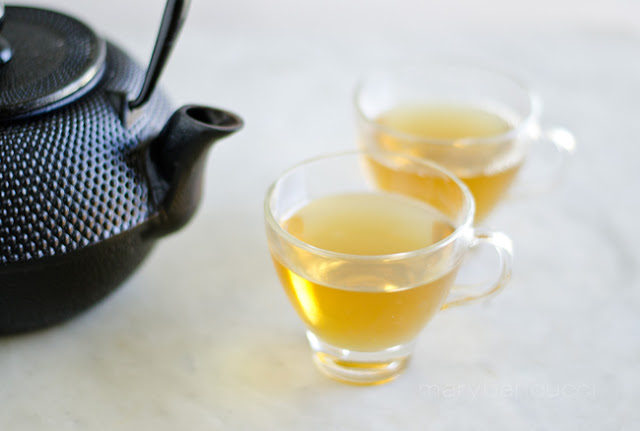
Image resolution: width=640 pixels, height=431 pixels. I want to click on handles, so click(560, 136), click(505, 249).